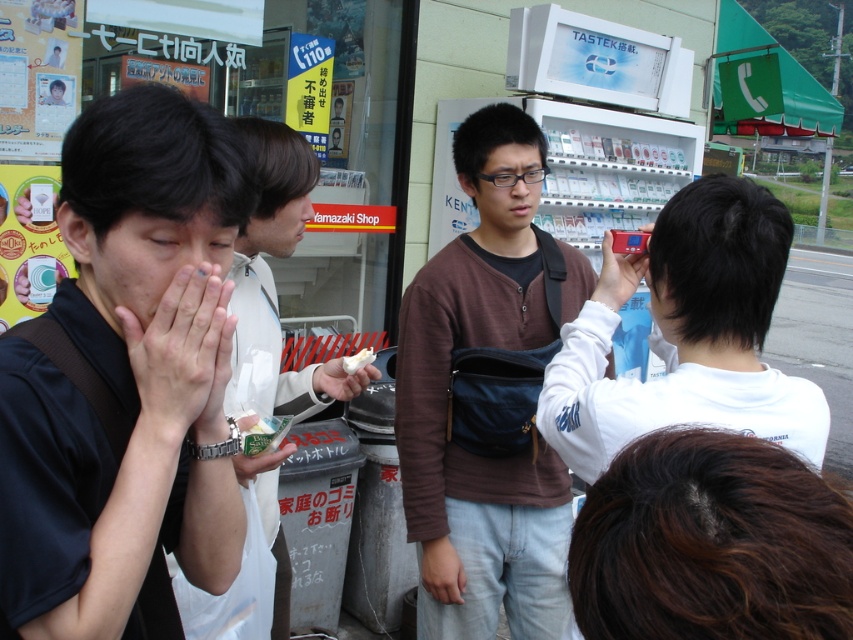
Question: Which object appears farthest from the camera in this image?

Choices:
 (A) white matte shirt at center
 (B) black fabric shirt at left
 (C) white matte paper at center
 (D) matte plastic phone at upper right

Answer: (C)

Question: Does brown cotton sweater at center appear over smooth skin hands at center left?

Choices:
 (A) no
 (B) yes

Answer: (A)

Question: Does white matte shirt at center appear on the right side of smooth skin hands at center left?

Choices:
 (A) no
 (B) yes

Answer: (A)

Question: Estimate the real-world distances between objects in this image. Which object is farther from the brown cotton sweater at center?

Choices:
 (A) white matte shirt at center
 (B) black fabric shirt at left
 (C) white matte sandwich at center

Answer: (B)

Question: Where is brown cotton sweater at center located in relation to matte plastic phone at upper right in the image?

Choices:
 (A) below
 (B) above

Answer: (A)

Question: Among these points, which one is nearest to the camera?

Choices:
 (A) (347, 372)
 (B) (175, 436)
 (C) (619, 298)

Answer: (B)